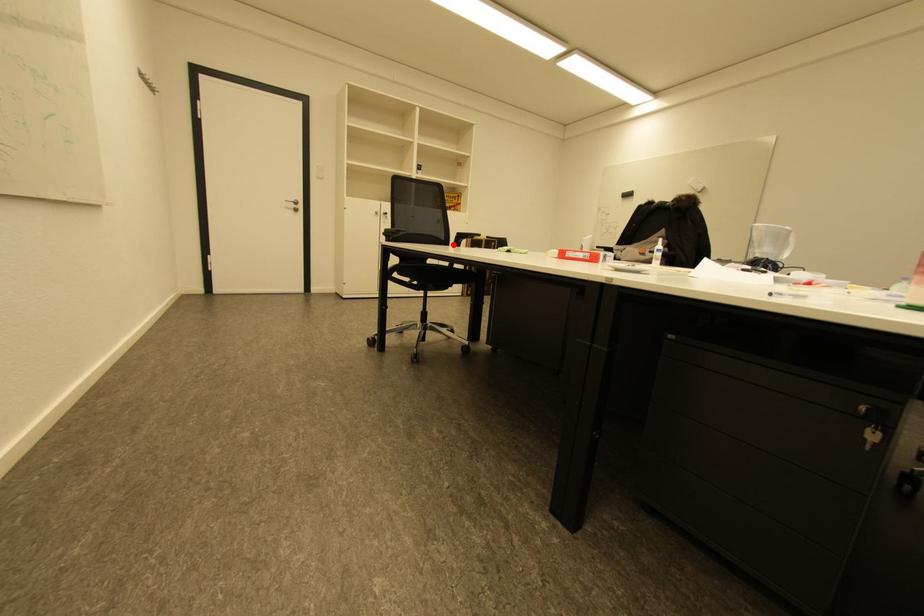
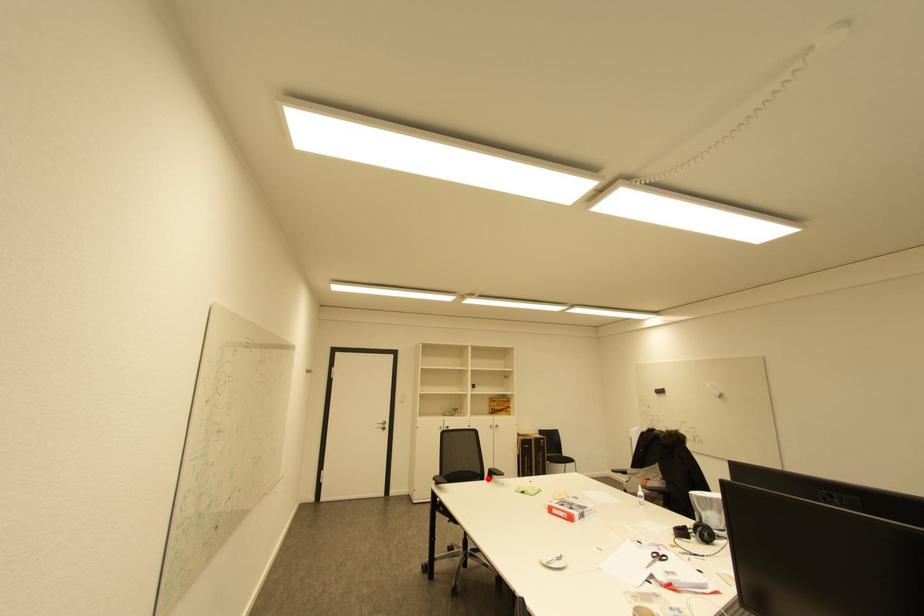
I am providing you with two images of the same scene from different viewpoints. A red point is marked on the first image and another point is marked on the second image. Are the points marked in image1 and image2 representing the same 3D position?

Yes